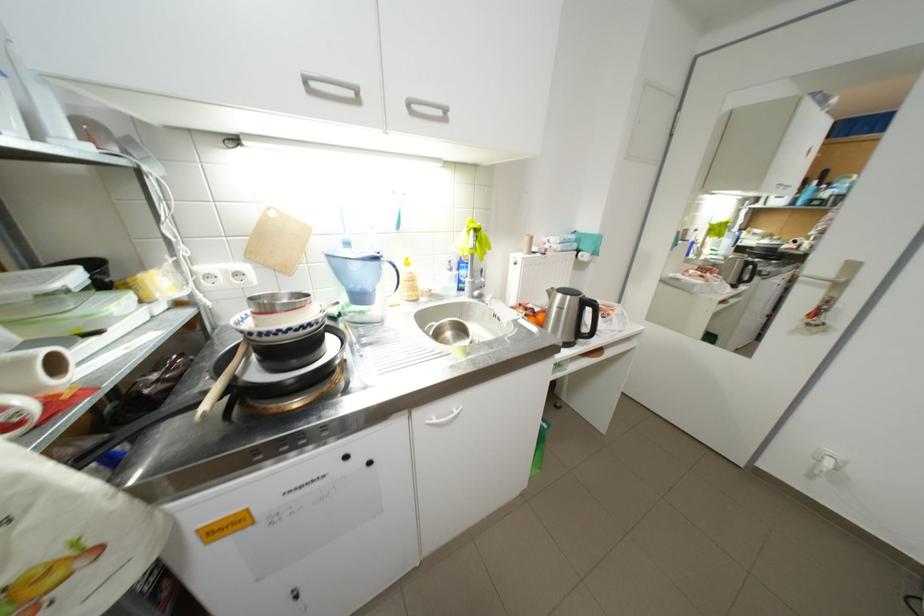
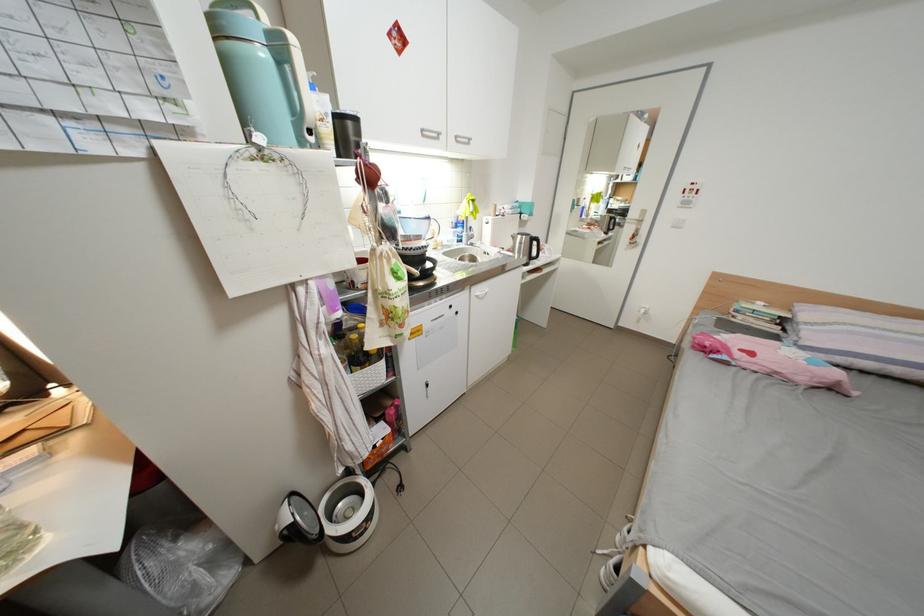
Question: The first image is from the beginning of the video and the second image is from the end. How did the camera likely rotate when shooting the video?

Choices:
 (A) Left
 (B) Right
 (C) Up
 (D) Down

Answer: (B)